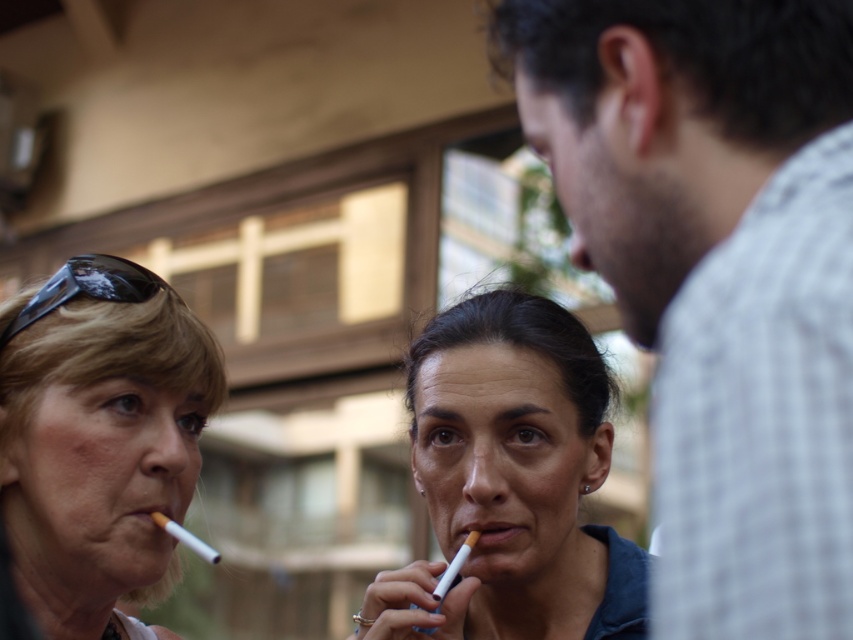
You are a photographer trying to capture a clear shot of the white checkered shirt at right and the white matte cigarette at center. Which object is closer to the camera?

The white checkered shirt at right is closer to the camera because it is in front of the white matte cigarette at center.

In the scene shown: You are a photographer trying to capture a candid shot of the two women in the scene. You notice the matte black sunglasses at upper left and the matte blue cigarette at center. Which object is positioned higher in the frame?

The matte black sunglasses at upper left are positioned higher in the frame than the matte blue cigarette at center according to the description.

You are a photographer trying to capture both the matte black sunglasses at upper left and the matte blue cigarette at center in a single frame. Since you want to ensure both are clearly visible, which object should you focus on first to account for their sizes?

The matte black sunglasses at upper left is smaller than the matte blue cigarette at center, so you should focus on the matte blue cigarette at center first because larger objects often require more precise focusing to capture details effectively.